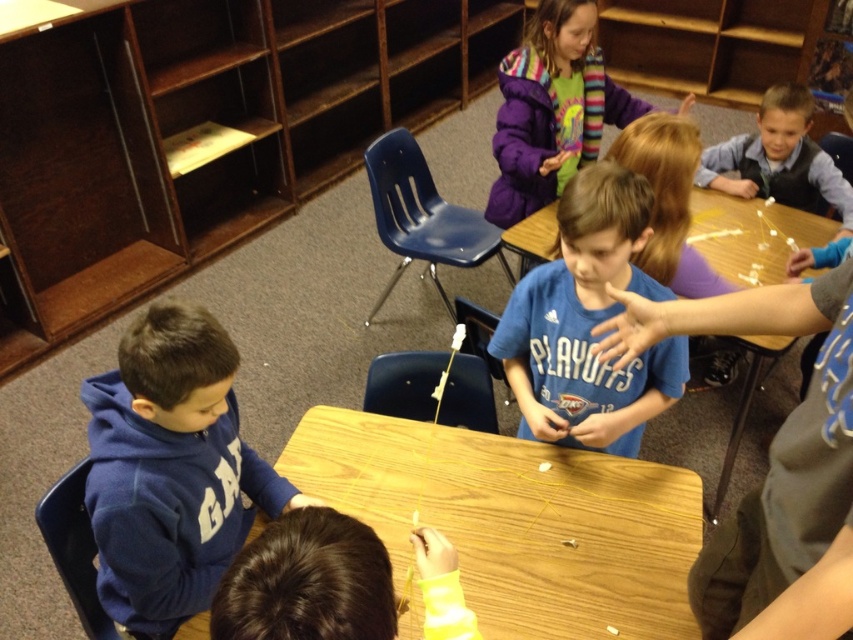
Between blue cotton shirt at center and purple fleece jacket at upper center, which one appears on the left side from the viewer's perspective?

blue cotton shirt at center is more to the left.

Find the location of a particular element. The height and width of the screenshot is (640, 853). blue cotton shirt at center is located at coordinates (587, 323).

Can you confirm if wooden table at center is shorter than purple fleece jacket at upper center?

Correct, wooden table at center is not as tall as purple fleece jacket at upper center.

This screenshot has height=640, width=853. I want to click on wooden table at center, so click(x=515, y=522).

Where is `wooden table at center`? Image resolution: width=853 pixels, height=640 pixels. wooden table at center is located at coordinates (515, 522).

Between blue fleece hoodie at lower left and dark brown hair at lower center, which one appears on the left side from the viewer's perspective?

blue fleece hoodie at lower left

Does point (169, 394) lie in front of point (428, 584)?

No.

Between point (138, 440) and point (267, 525), which one is positioned behind?

The point (138, 440) is more distant.

The width and height of the screenshot is (853, 640). In order to click on blue fleece hoodie at lower left in this screenshot , I will do `click(171, 470)`.